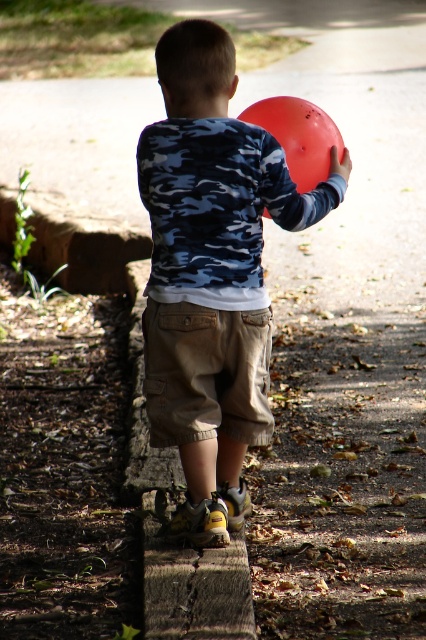
Question: Does matte blue camouflage shirt at center have a lesser width compared to khaki cotton shorts at center?

Choices:
 (A) no
 (B) yes

Answer: (A)

Question: Can you confirm if brown wood curb at lower center is smaller than khaki cotton shorts at center?

Choices:
 (A) yes
 (B) no

Answer: (B)

Question: Does matte blue camouflage shirt at center have a greater width compared to rubber balloon at back?

Choices:
 (A) no
 (B) yes

Answer: (B)

Question: Which point is farther to the camera?

Choices:
 (A) (169, 620)
 (B) (301, 120)
 (C) (267, 168)
 (D) (204, 337)

Answer: (B)

Question: Which object is positioned farthest from the matte blue camouflage shirt at center?

Choices:
 (A) rubber balloon at back
 (B) khaki cotton shorts at center
 (C) brown wood curb at lower center

Answer: (C)

Question: Which object is farther from the camera taking this photo?

Choices:
 (A) rubber balloon at back
 (B) khaki cotton shorts at center
 (C) brown wood curb at lower center
 (D) matte blue camouflage shirt at center

Answer: (A)